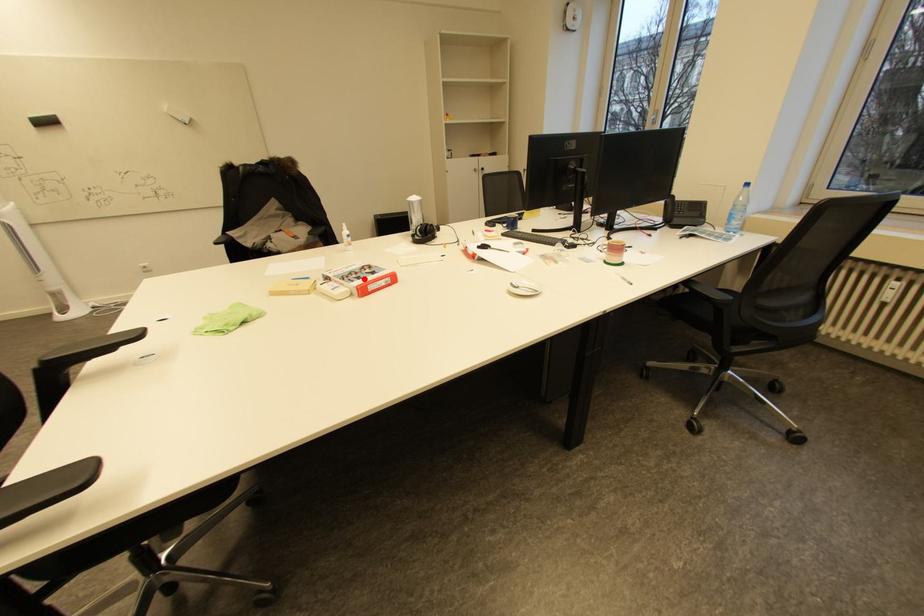
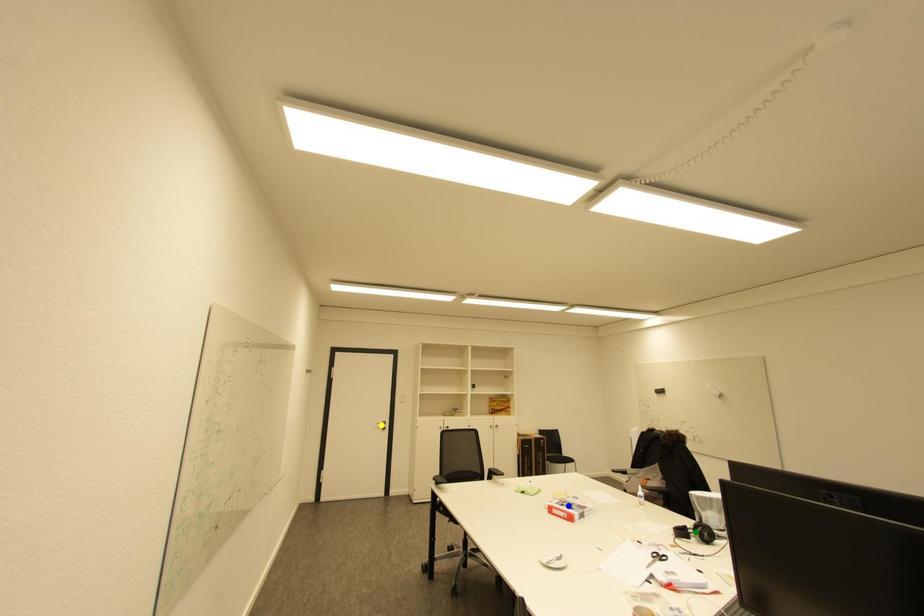
Question: I am providing you with two images of the same scene from different viewpoints. A red point is marked on the first image. You are given multiple points on the second image. Can you choose the point in image 2 that corresponds to the point in image 1?

Choices:
 (A) blue point
 (B) yellow point
 (C) green point

Answer: (A)